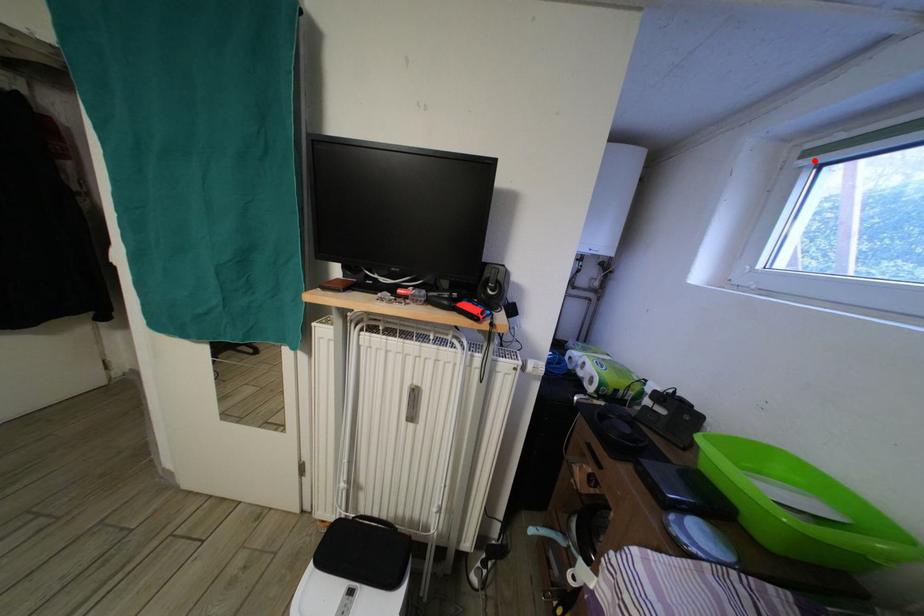
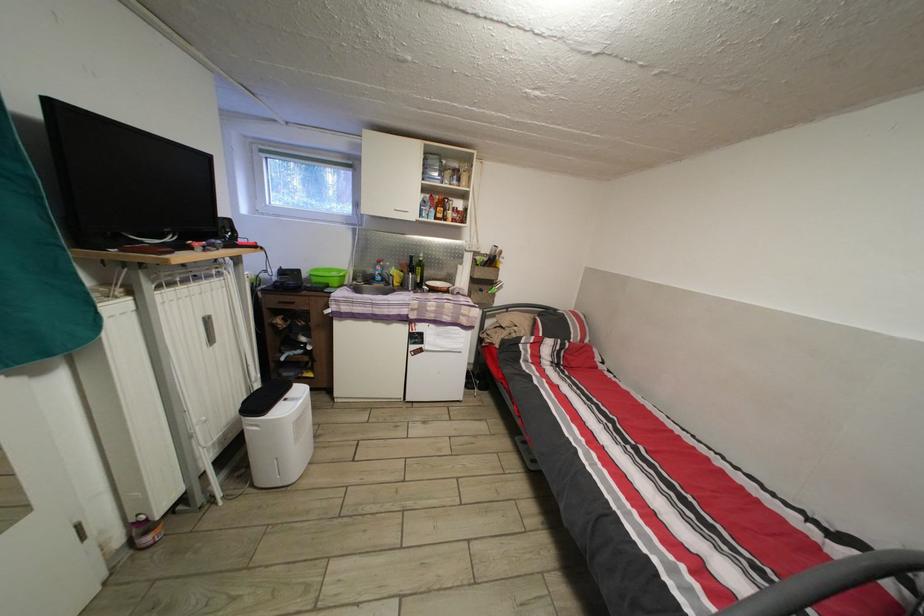
Question: I am providing you with two images of the same scene from different viewpoints. Image1 has a red point marked. In image2, the corresponding 3D location appears at what relative position? Reply with the corresponding letter.

Choices:
 (A) Closer
 (B) Farther

Answer: (B)